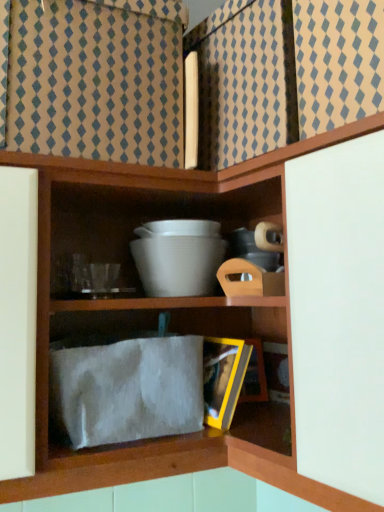
Find the location of a particular element. The width and height of the screenshot is (384, 512). white matte bowl at center is located at coordinates (178, 264).

Measure the distance between white matte bowl at center and camera.

They are 34.04 inches apart.

Describe the element at coordinates (178, 264) in the screenshot. I see `white matte bowl at center` at that location.

What do you see at coordinates (127, 389) in the screenshot? I see `white fuzzy cloth at lower center` at bounding box center [127, 389].

Locate an element on the screen. This screenshot has height=512, width=384. white fuzzy cloth at lower center is located at coordinates (127, 389).

What are the coordinates of `white matte bowl at center` in the screenshot? It's located at (178, 264).

Can you confirm if white matte bowl at center is positioned to the right of white fuzzy cloth at lower center?

Indeed, white matte bowl at center is positioned on the right side of white fuzzy cloth at lower center.

Which is in front, white matte bowl at center or white fuzzy cloth at lower center?

white fuzzy cloth at lower center.

Is point (194, 251) closer to camera compared to point (79, 434)?

That is False.

From the image's perspective, is white matte bowl at center under white fuzzy cloth at lower center?

Incorrect, from the image's perspective, white matte bowl at center is higher than white fuzzy cloth at lower center.

From a real-world perspective, is white matte bowl at center physically located above or below white fuzzy cloth at lower center?

white matte bowl at center is situated higher than white fuzzy cloth at lower center in the real world.

Which object is wider, white matte bowl at center or white fuzzy cloth at lower center?

white matte bowl at center is wider.

Considering the sizes of objects white matte bowl at center and white fuzzy cloth at lower center in the image provided, who is taller, white matte bowl at center or white fuzzy cloth at lower center?

With more height is white fuzzy cloth at lower center.

In terms of size, does white matte bowl at center appear bigger or smaller than white fuzzy cloth at lower center?

Considering their sizes, white matte bowl at center takes up less space than white fuzzy cloth at lower center.

Is white matte bowl at center not within white fuzzy cloth at lower center?

Yes, white matte bowl at center is not within white fuzzy cloth at lower center.

Would you say white matte bowl at center is a long distance from white fuzzy cloth at lower center?

No, white matte bowl at center is in close proximity to white fuzzy cloth at lower center.

Is white matte bowl at center facing away from white fuzzy cloth at lower center?

No.

How many degrees apart are the facing directions of white matte bowl at center and white fuzzy cloth at lower center?

There is a 1.41-degree angle between the facing directions of white matte bowl at center and white fuzzy cloth at lower center.

Locate an element on the screen. cloth in front of the white matte bowl at center is located at coordinates (127, 389).

Which is more to the left, white fuzzy cloth at lower center or white matte bowl at center?

From the viewer's perspective, white fuzzy cloth at lower center appears more on the left side.

Does white fuzzy cloth at lower center come in front of white matte bowl at center?

Yes, it is.

Is point (74, 400) behind point (139, 265)?

That is False.

From the image's perspective, which is above, white fuzzy cloth at lower center or white matte bowl at center?

white matte bowl at center, from the image's perspective.

From a real-world perspective, is white fuzzy cloth at lower center on white matte bowl at center?

No.

Which object is wider, white fuzzy cloth at lower center or white matte bowl at center?

white matte bowl at center is wider.

Does white fuzzy cloth at lower center have a greater height compared to white matte bowl at center?

Correct, white fuzzy cloth at lower center is much taller as white matte bowl at center.

Considering the sizes of objects white fuzzy cloth at lower center and white matte bowl at center in the image provided, who is smaller, white fuzzy cloth at lower center or white matte bowl at center?

With smaller size is white matte bowl at center.

Can we say white fuzzy cloth at lower center lies outside white matte bowl at center?

Absolutely, white fuzzy cloth at lower center is external to white matte bowl at center.

Is white fuzzy cloth at lower center touching white matte bowl at center?

white fuzzy cloth at lower center and white matte bowl at center are clearly separated.

Is white fuzzy cloth at lower center facing towards white matte bowl at center?

No.

How different are the orientations of white fuzzy cloth at lower center and white matte bowl at center in degrees?

1.41 degrees separate the facing orientations of white fuzzy cloth at lower center and white matte bowl at center.

This screenshot has width=384, height=512. In order to click on bowl behind the white fuzzy cloth at lower center in this screenshot , I will do click(x=178, y=264).

You are a GUI agent. You are given a task and a screenshot of the screen. Output one action in this format:
    pyautogui.click(x=<x>, y=<y>)
    Task: Click on the bowl located above the white fuzzy cloth at lower center (from a real-world perspective)
    The width and height of the screenshot is (384, 512).
    Given the screenshot: What is the action you would take?
    pyautogui.click(x=178, y=264)

Identify the location of bowl above the white fuzzy cloth at lower center (from the image's perspective). (178, 264).